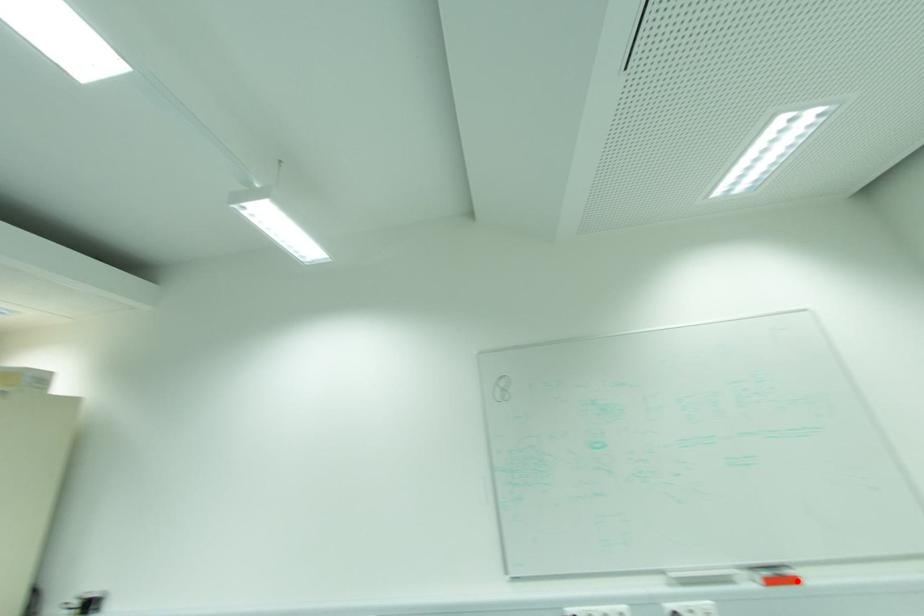
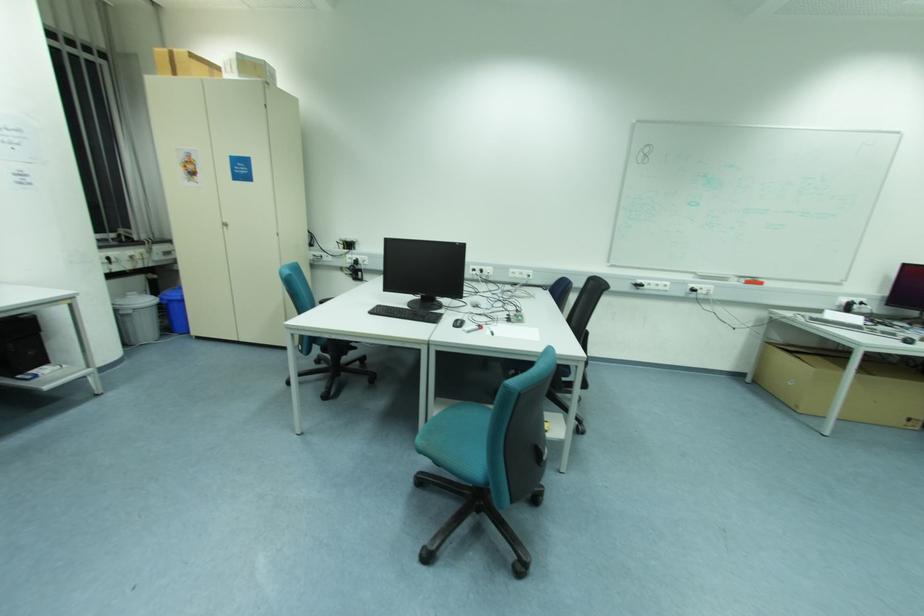
Question: I am providing you with two images of the same scene from different viewpoints. Image1 has a red point marked. In image2, the corresponding 3D location appears at what relative position? Reply with the corresponding letter.

Choices:
 (A) Closer
 (B) Farther

Answer: (B)